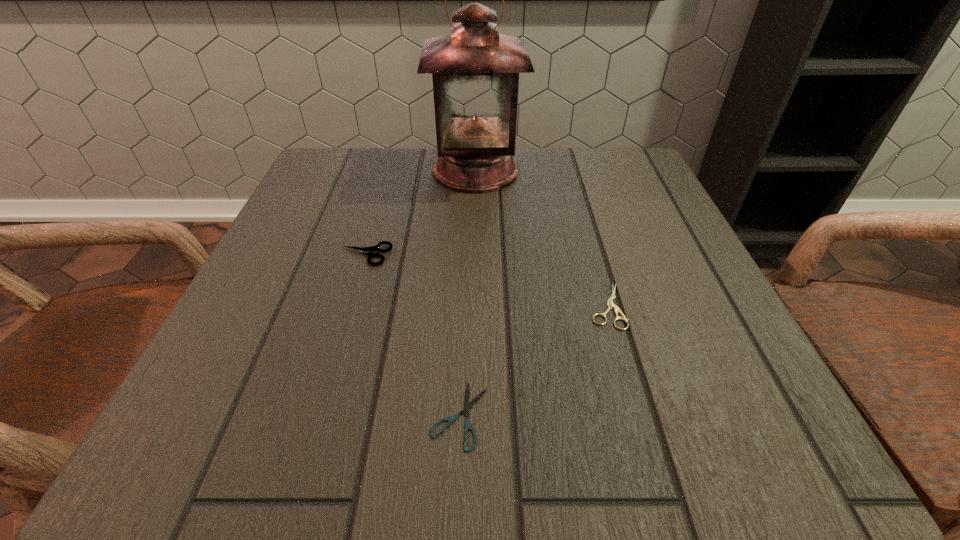
I want to click on blank space located 0.110m on the back of the second shortest object, so click(x=588, y=241).

The height and width of the screenshot is (540, 960). Identify the location of free spot located 0.170m on the left of the nearest shears. (295, 415).

Where is `object at the far edge`? The width and height of the screenshot is (960, 540). object at the far edge is located at coordinates (475, 70).

Where is `object that is at the near edge`? This screenshot has width=960, height=540. object that is at the near edge is located at coordinates (467, 405).

Locate an element on the screen. The width and height of the screenshot is (960, 540). object that is at the left edge is located at coordinates (368, 251).

Where is `object positioned at the right edge`? This screenshot has height=540, width=960. object positioned at the right edge is located at coordinates (610, 304).

At what (x,y) coordinates should I click in order to perform the action: click on free location at the far edge of the desktop. Please return your answer as a coordinate pair (x, y). Image resolution: width=960 pixels, height=540 pixels. Looking at the image, I should click on (519, 184).

At what (x,y) coordinates should I click in order to perform the action: click on vacant area at the left edge of the desktop. Please return your answer as a coordinate pair (x, y). The image size is (960, 540). Looking at the image, I should click on (223, 355).

Locate an element on the screen. This screenshot has height=540, width=960. vacant region at the right edge of the desktop is located at coordinates (648, 267).

Locate an element on the screen. free space at the far right corner of the desktop is located at coordinates (610, 192).